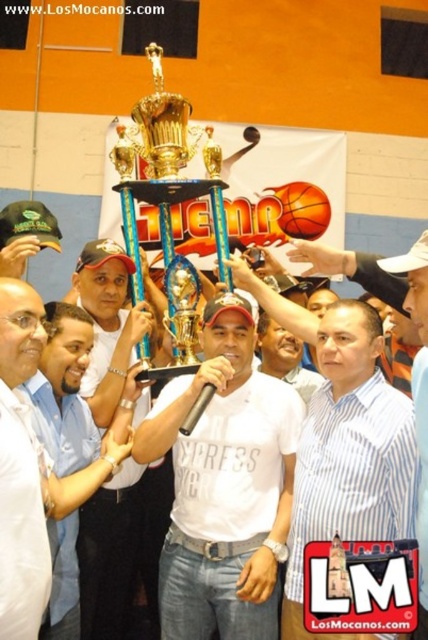
Where is the white striped shirt at center located in the image?

The white striped shirt at center is located at point (350,454).